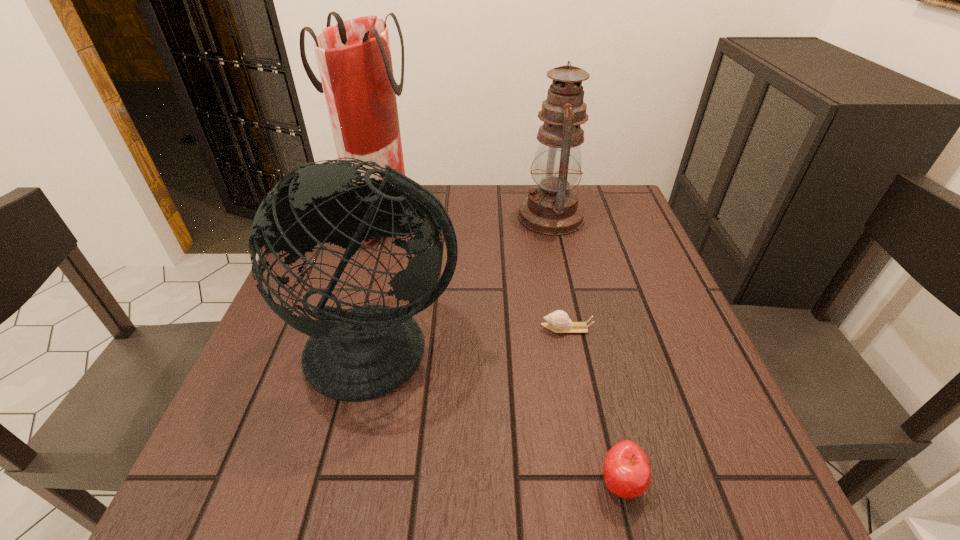
The height and width of the screenshot is (540, 960). What are the coordinates of `free location located on the shell of the escargot` in the screenshot? It's located at (383, 329).

Find the location of `vacant space situated on the shell of the escargot`. vacant space situated on the shell of the escargot is located at coordinates (492, 329).

Identify the location of vacant space located on the shell of the escargot. (383, 329).

The image size is (960, 540). Identify the location of grocery bag that is at the far edge. (354, 59).

The height and width of the screenshot is (540, 960). Find the location of `oil lamp located at the far edge`. oil lamp located at the far edge is located at coordinates (552, 208).

This screenshot has height=540, width=960. What are the coordinates of `object situated at the near edge` in the screenshot? It's located at (626, 470).

Identify the location of grocery bag that is at the left edge. (354, 59).

At what (x,y) coordinates should I click in order to perform the action: click on globe that is at the left edge. Please return your answer as a coordinate pair (x, y). The width and height of the screenshot is (960, 540). Looking at the image, I should click on (361, 353).

What are the coordinates of `object present at the right edge` in the screenshot? It's located at (552, 208).

Where is `object present at the far left corner`? object present at the far left corner is located at coordinates (354, 59).